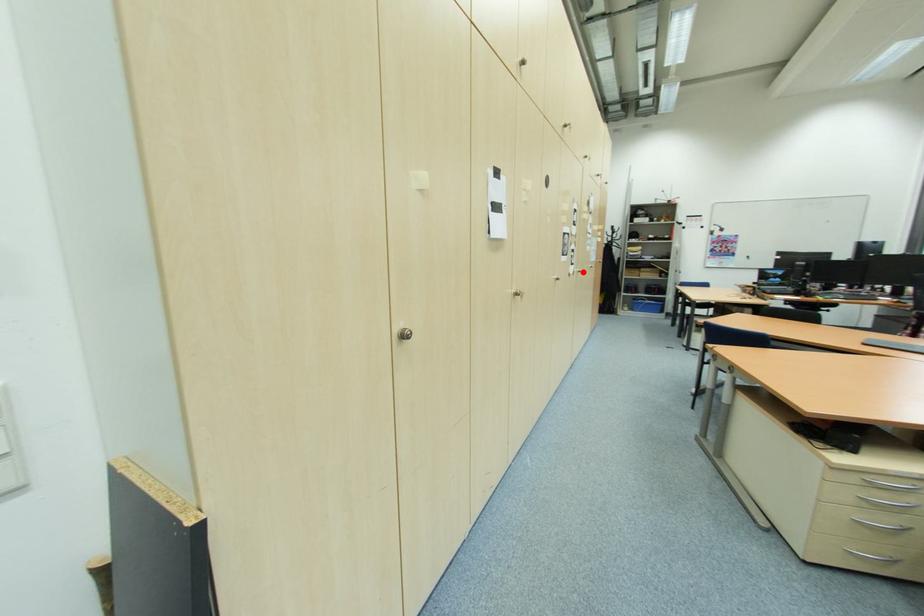
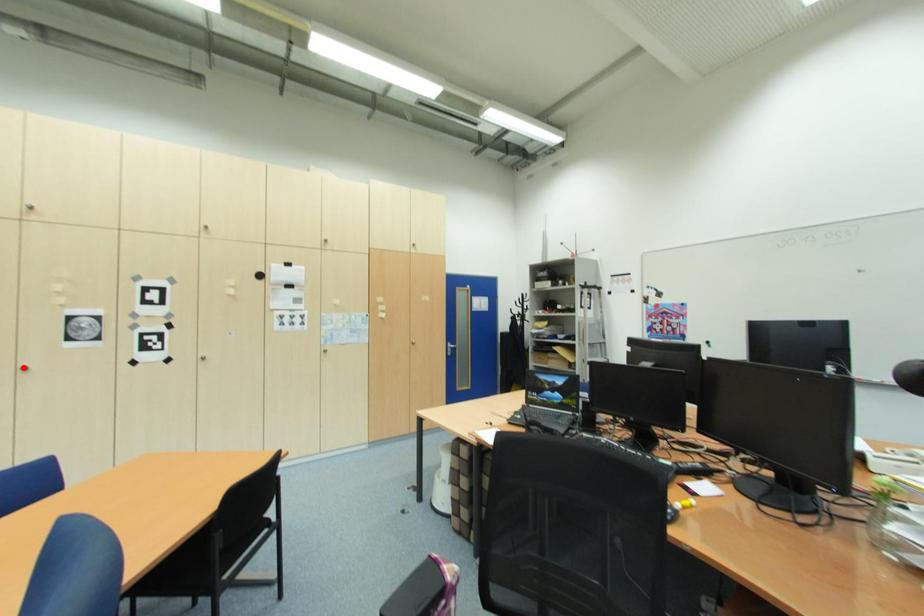
I am providing you with two images of the same scene from different viewpoints. A red point is marked on the first image and another point is marked on the second image. Is the red point in image1 aligned with the point shown in image2?

No